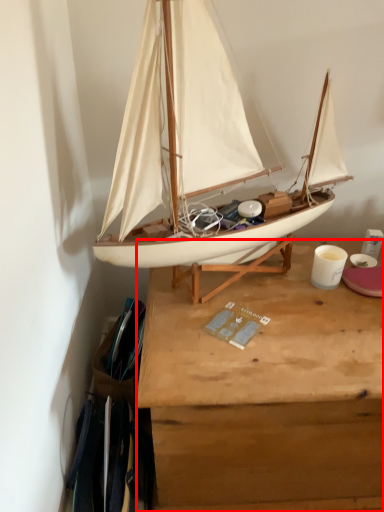
Question: From the image's perspective, where is desk (annotated by the red box) located relative to boat?

Choices:
 (A) below
 (B) above

Answer: (A)